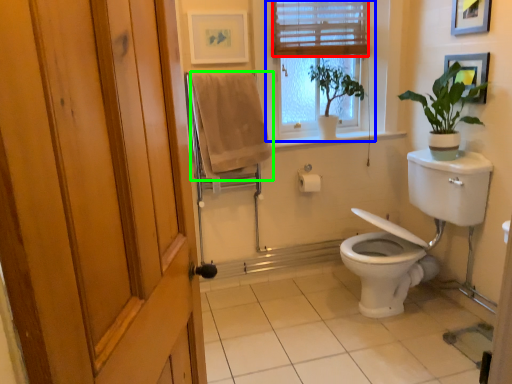
Question: Which object is the closest to the blind (highlighted by a red box)? Choose among these: window (highlighted by a blue box) or bath towel (highlighted by a green box).

Choices:
 (A) window
 (B) bath towel

Answer: (A)